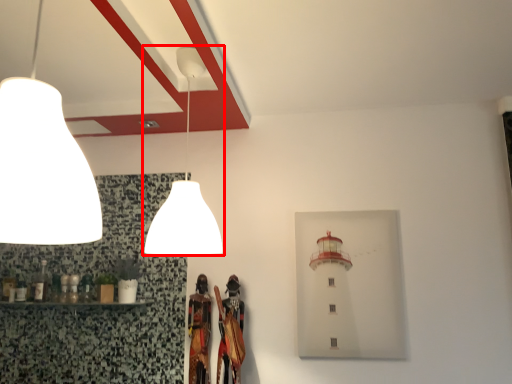
Question: From the image, what is the correct spatial relationship of lamp (annotated by the red box) in relation to lamp?

Choices:
 (A) right
 (B) left

Answer: (A)